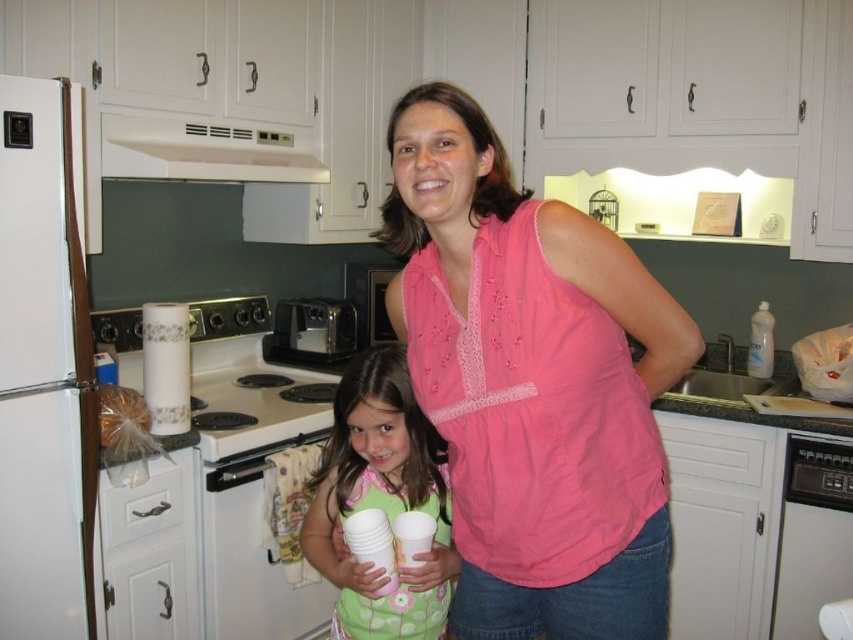
Looking at this image, you are a delivery person who needs to place a large box behind both the white matte refrigerator at left and the black plastic dishwasher at lower right. Is this possible?

The white matte refrigerator at left is in front of the black plastic dishwasher at lower right, so there is no space behind both objects to place the large box.

You are a home inspector assessing the kitchen layout. You need to determine if the white matte exhaust hood at upper center can fit under the metallic silver toaster at center based on their heights. Can it?

The white matte exhaust hood at upper center is shorter than the metallic silver toaster at center, so it cannot fit under the metallic silver toaster at center because it is shorter.